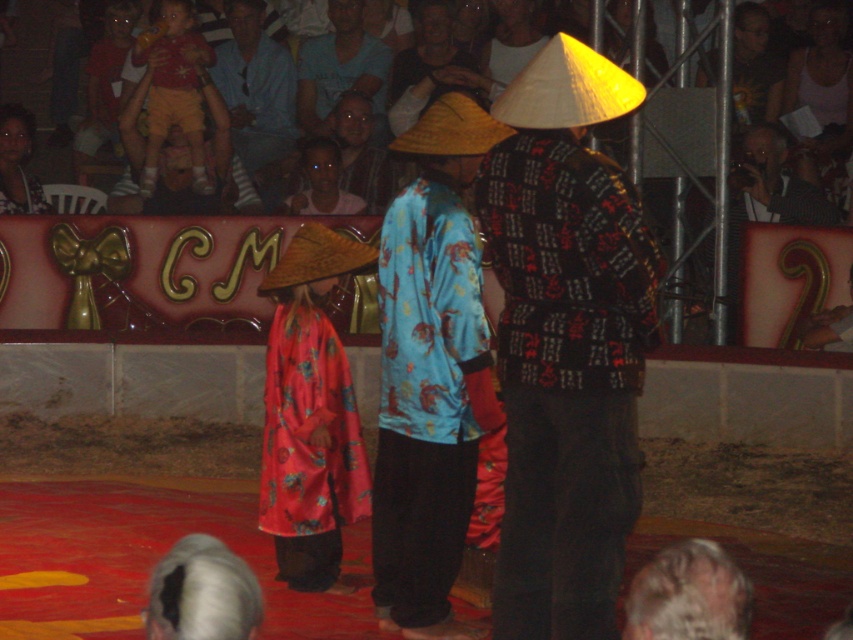
Question: Is blue satin robe at center positioned before gray hair at lower center?

Choices:
 (A) yes
 (B) no

Answer: (B)

Question: Which of the following is the closest to the observer?

Choices:
 (A) gray hair at lower center
 (B) silky red robe at center
 (C) matte black conical hat at upper center

Answer: (A)

Question: Which of these objects is positioned closest to the silky red robe at center?

Choices:
 (A) matte black conical hat at upper center
 (B) patterned fabric robe at center
 (C) gray hair at lower center
 (D) blue cotton shirt at upper center

Answer: (B)

Question: Among these points, which one is farthest from the camera?

Choices:
 (A) (413, 548)
 (B) (274, 275)
 (C) (257, 104)

Answer: (C)

Question: Is patterned fabric robe at center in front of blue cotton shirt at center?

Choices:
 (A) yes
 (B) no

Answer: (A)

Question: Is gray hair at lower center to the left of matte black hair at upper left from the viewer's perspective?

Choices:
 (A) yes
 (B) no

Answer: (B)